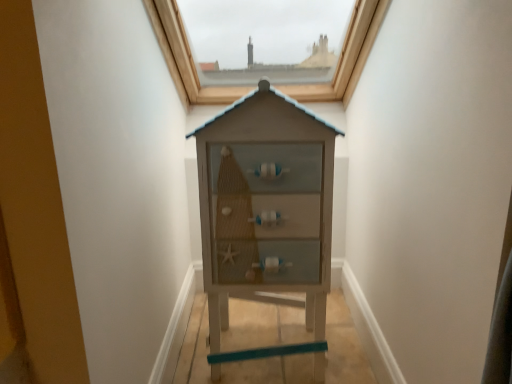
What is the approximate width of wooden cabinet at center?

wooden cabinet at center is 16.09 inches in width.

Based on the photo, measure the distance between wooden cabinet at center and camera.

A distance of 3.79 feet exists between wooden cabinet at center and camera.

At what (x,y) coordinates should I click in order to perform the action: click on wooden cabinet at center. Please return your answer as a coordinate pair (x, y). This screenshot has height=384, width=512. Looking at the image, I should click on (266, 213).

Describe the element at coordinates (266, 213) in the screenshot. This screenshot has width=512, height=384. I see `wooden cabinet at center` at that location.

The height and width of the screenshot is (384, 512). What do you see at coordinates (185, 57) in the screenshot?
I see `matte brown wooden window at upper center` at bounding box center [185, 57].

What is the approximate height of matte brown wooden window at upper center?

matte brown wooden window at upper center is 17.83 inches tall.

This screenshot has height=384, width=512. In order to click on matte brown wooden window at upper center in this screenshot , I will do `click(185, 57)`.

Measure the distance between point (222, 102) and camera.

Point (222, 102) is 6.20 feet from camera.

Image resolution: width=512 pixels, height=384 pixels. Find the location of `wooden cabinet at center`. wooden cabinet at center is located at coordinates (266, 213).

Which is more to the left, matte brown wooden window at upper center or wooden cabinet at center?

matte brown wooden window at upper center.

Relative to wooden cabinet at center, is matte brown wooden window at upper center in front or behind?

Visually, matte brown wooden window at upper center is located behind wooden cabinet at center.

Which is closer to the camera, (175, 40) or (323, 281)?

Point (175, 40) is farther from the camera than point (323, 281).

Consider the image. From the image's perspective, which one is positioned higher, matte brown wooden window at upper center or wooden cabinet at center?

matte brown wooden window at upper center.

From a real-world perspective, which is physically above, matte brown wooden window at upper center or wooden cabinet at center?

matte brown wooden window at upper center, from a real-world perspective.

In terms of width, does matte brown wooden window at upper center look wider or thinner when compared to wooden cabinet at center?

Considering their sizes, matte brown wooden window at upper center looks broader than wooden cabinet at center.

Is matte brown wooden window at upper center taller than wooden cabinet at center?

Incorrect, the height of matte brown wooden window at upper center is not larger of that of wooden cabinet at center.

Who is smaller, matte brown wooden window at upper center or wooden cabinet at center?

With smaller size is wooden cabinet at center.

Would you say matte brown wooden window at upper center is inside or outside wooden cabinet at center?

matte brown wooden window at upper center is spatially situated outside wooden cabinet at center.

Are matte brown wooden window at upper center and wooden cabinet at center beside each other?

matte brown wooden window at upper center and wooden cabinet at center are clearly separated.

Could you tell me if matte brown wooden window at upper center is turned towards wooden cabinet at center?

No, matte brown wooden window at upper center does not turn towards wooden cabinet at center.

In the scene shown: How many degrees apart are the facing directions of matte brown wooden window at upper center and wooden cabinet at center?

The angular difference between matte brown wooden window at upper center and wooden cabinet at center is 3.58 degrees.

Where is `dresser in front of the matte brown wooden window at upper center`? The height and width of the screenshot is (384, 512). dresser in front of the matte brown wooden window at upper center is located at coordinates (266, 213).

Looking at this image, considering the relative positions of wooden cabinet at center and matte brown wooden window at upper center in the image provided, is wooden cabinet at center to the right of matte brown wooden window at upper center from the viewer's perspective?

Indeed, wooden cabinet at center is positioned on the right side of matte brown wooden window at upper center.

Is the depth of wooden cabinet at center greater than that of matte brown wooden window at upper center?

That is False.

Is point (313, 183) in front of point (325, 90)?

That is True.

From the image's perspective, is wooden cabinet at center below matte brown wooden window at upper center?

Yes, from the image's perspective, wooden cabinet at center is below matte brown wooden window at upper center.

From a real-world perspective, which object stands above the other?

From a 3D spatial view, matte brown wooden window at upper center is above.

Considering the sizes of objects wooden cabinet at center and matte brown wooden window at upper center in the image provided, who is wider, wooden cabinet at center or matte brown wooden window at upper center?

matte brown wooden window at upper center is wider.

Considering the relative sizes of wooden cabinet at center and matte brown wooden window at upper center in the image provided, is wooden cabinet at center taller than matte brown wooden window at upper center?

Yes.

Who is bigger, wooden cabinet at center or matte brown wooden window at upper center?

With larger size is matte brown wooden window at upper center.

Is wooden cabinet at center positioned beyond the bounds of matte brown wooden window at upper center?

Yes, wooden cabinet at center is outside of matte brown wooden window at upper center.

Is wooden cabinet at center far away from matte brown wooden window at upper center?

No, wooden cabinet at center is not far away from matte brown wooden window at upper center.

Could you tell me if wooden cabinet at center is turned towards matte brown wooden window at upper center?

No, wooden cabinet at center is not oriented towards matte brown wooden window at upper center.

How many degrees apart are the facing directions of wooden cabinet at center and matte brown wooden window at upper center?

There is a 3.58-degree angle between the facing directions of wooden cabinet at center and matte brown wooden window at upper center.

You are a GUI agent. You are given a task and a screenshot of the screen. Output one action in this format:
    pyautogui.click(x=<x>, y=<y>)
    Task: Click on the window on the left of wooden cabinet at center
    This screenshot has width=512, height=384.
    Given the screenshot: What is the action you would take?
    pyautogui.click(x=185, y=57)

At what (x,y) coordinates should I click in order to perform the action: click on dresser in front of the matte brown wooden window at upper center. Please return your answer as a coordinate pair (x, y). Looking at the image, I should click on (266, 213).

You are a GUI agent. You are given a task and a screenshot of the screen. Output one action in this format:
    pyautogui.click(x=<x>, y=<y>)
    Task: Click on the window on the left of wooden cabinet at center
    
    Given the screenshot: What is the action you would take?
    pyautogui.click(x=185, y=57)